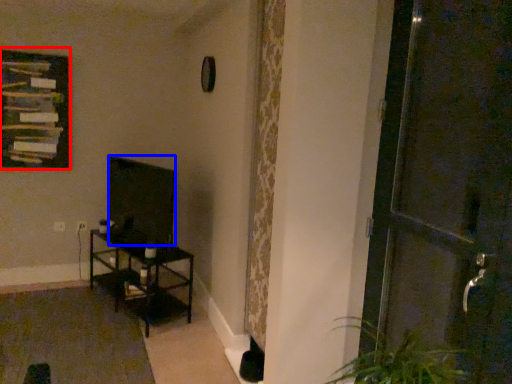
Question: Which object is closer to the camera taking this photo, picture frame (highlighted by a red box) or wide (highlighted by a blue box)?

Choices:
 (A) picture frame
 (B) wide

Answer: (B)